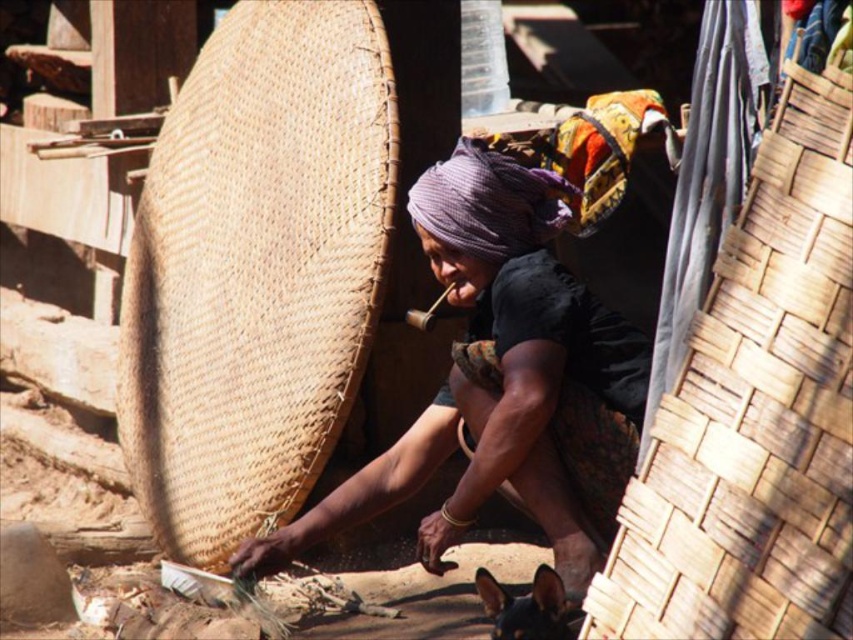
Can you confirm if matte woven basket at center is smaller than black glossy dog at lower right?

Actually, matte woven basket at center might be larger than black glossy dog at lower right.

Is point (502, 273) behind point (531, 593)?

Yes.

In order to click on matte woven basket at center in this screenshot , I will do `click(503, 378)`.